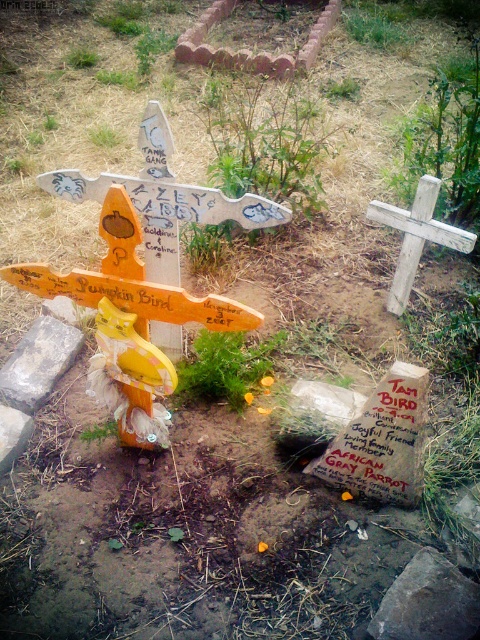
Does gray stone at lower left have a larger size compared to smooth gray stone at lower left?

Yes.

At what (x,y) coordinates should I click in order to perform the action: click on gray stone at lower left. Please return your answer as a coordinate pair (x, y). This screenshot has width=480, height=640. Looking at the image, I should click on (38, 362).

Which of these two, wooden cross at center or gray stone at lower left, stands shorter?

gray stone at lower left

Can you confirm if wooden cross at center is taller than gray stone at lower left?

Indeed, wooden cross at center has a greater height compared to gray stone at lower left.

Locate an element on the screen. The height and width of the screenshot is (640, 480). wooden cross at center is located at coordinates (165, 198).

I want to click on wooden cross at center, so click(165, 198).

Who is more forward, (x=408, y=586) or (x=403, y=225)?

Point (x=408, y=586) is in front.

Is smooth gray rock at lower right further to camera compared to weathered wood cross at upper right?

No.

Is point (428, 620) closer to camera compared to point (436, 228)?

That is True.

Image resolution: width=480 pixels, height=640 pixels. In order to click on smooth gray rock at lower right in this screenshot , I will do pos(428,602).